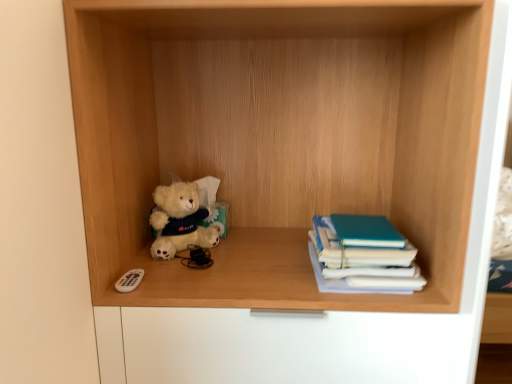
This screenshot has width=512, height=384. I want to click on empty space that is ontop of teal matte book at right, so click(360, 224).